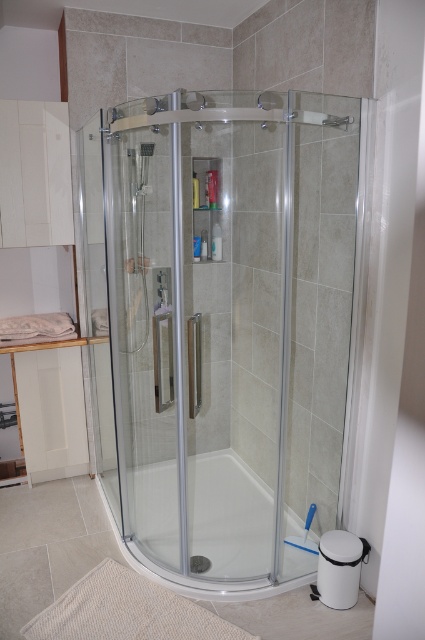
Between transparent glass shower door at center and transparent glass bathtub at center, which one is positioned higher?

transparent glass shower door at center is above.

Measure the distance between transparent glass shower door at center and camera.

transparent glass shower door at center and camera are 1.76 meters apart from each other.

You are a GUI agent. You are given a task and a screenshot of the screen. Output one action in this format:
    pyautogui.click(x=<x>, y=<y>)
    Task: Click on the transparent glass shower door at center
    Image resolution: width=425 pixels, height=640 pixels.
    Given the screenshot: What is the action you would take?
    pyautogui.click(x=223, y=324)